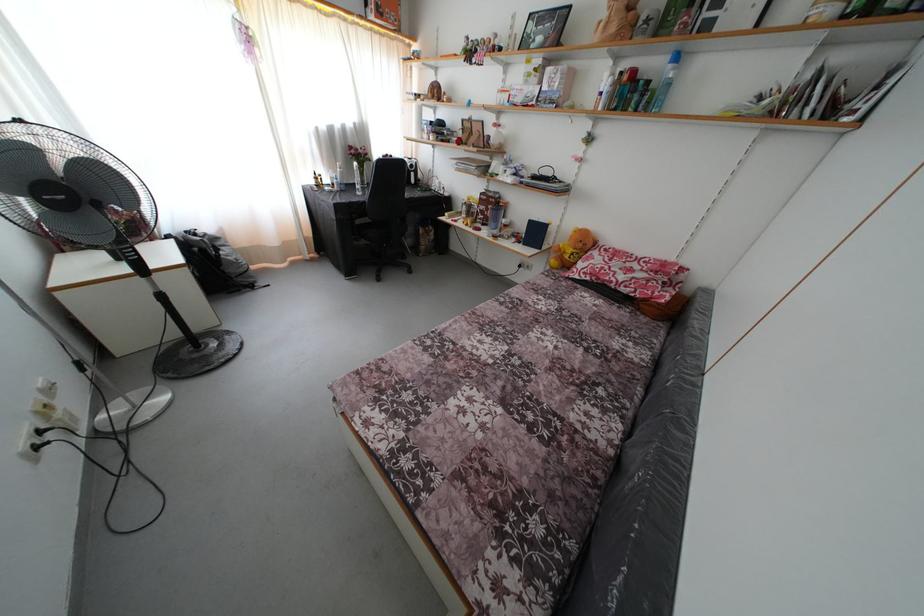
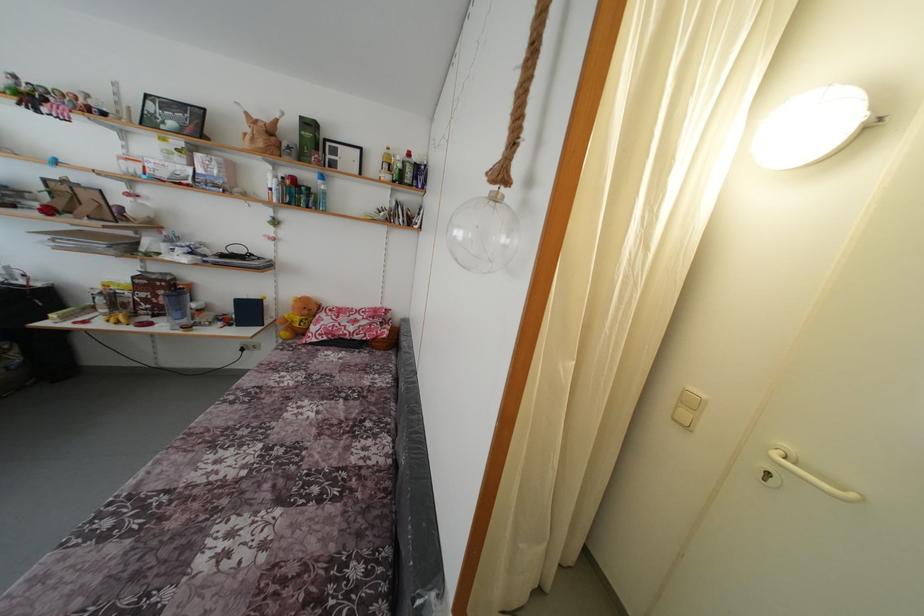
Find the pixel in the second image that matches (x=675, y=73) in the first image.

(324, 188)